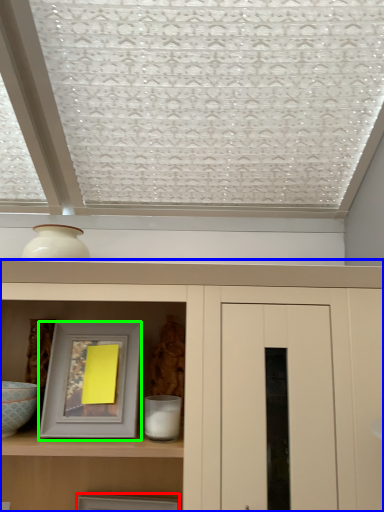
Question: Estimate the real-world distances between objects in this image. Which object is farther from picture frame (highlighted by a red box), cupboard (highlighted by a blue box) or picture frame (highlighted by a green box)?

Choices:
 (A) cupboard
 (B) picture frame

Answer: (A)